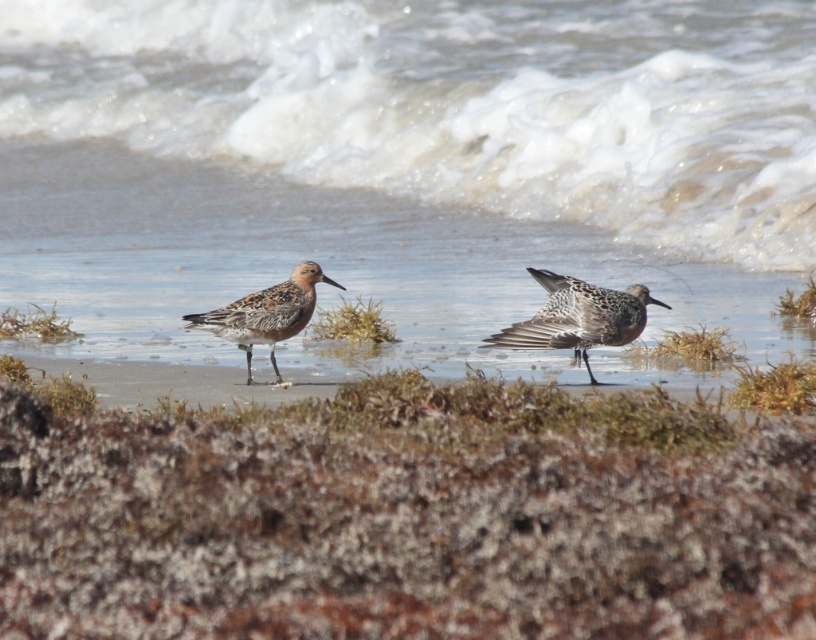
Question: Considering the relative positions of white frothy water at center and brown speckled feathers at center in the image provided, where is white frothy water at center located with respect to brown speckled feathers at center?

Choices:
 (A) left
 (B) right

Answer: (A)

Question: Is white frothy water at center further to the viewer compared to brown speckled sandpiper at center?

Choices:
 (A) yes
 (B) no

Answer: (A)

Question: Which point is closer to the camera?

Choices:
 (A) (540, 278)
 (B) (49, 52)

Answer: (A)

Question: Can you confirm if brown speckled feathers at center is bigger than brown speckled sandpiper at center?

Choices:
 (A) yes
 (B) no

Answer: (A)

Question: Which object appears closest to the camera in this image?

Choices:
 (A) brown speckled feathers at center
 (B) brown speckled sandpiper at center
 (C) white frothy water at center

Answer: (A)

Question: Which point is closer to the camera taking this photo?

Choices:
 (A) click(204, 320)
 (B) click(593, 320)

Answer: (B)